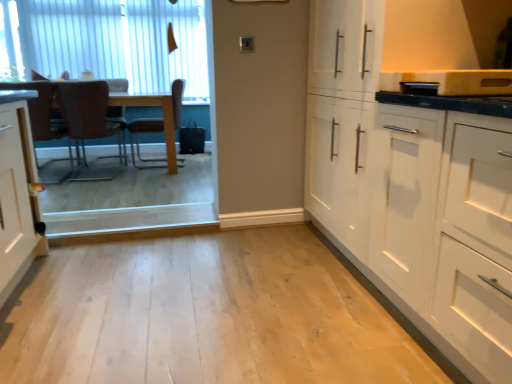
You are a GUI agent. You are given a task and a screenshot of the screen. Output one action in this format:
    pyautogui.click(x=<x>, y=<y>)
    Task: Click on the empty space that is ontop of light wood floor at center
    This screenshot has width=512, height=384.
    Given the screenshot: What is the action you would take?
    coord(225,325)